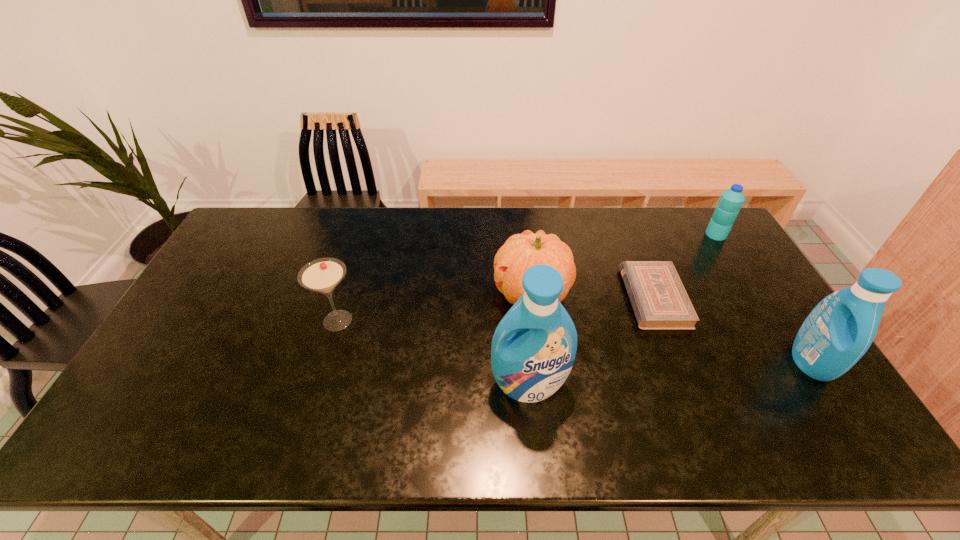
At what (x,y) coordinates should I click in order to perform the action: click on empty space between the fourth object from left to right and the farthest object. Please return your answer as a coordinate pair (x, y). This screenshot has width=960, height=540. Looking at the image, I should click on (685, 266).

Where is `unoccupied position between the water bottle and the taller detergent`? unoccupied position between the water bottle and the taller detergent is located at coordinates (623, 309).

This screenshot has height=540, width=960. Identify the location of vacant area between the Bible and the leftmost object. (495, 309).

Find the location of a particular element. The image size is (960, 540). empty location between the fourth shortest object and the third object from right to left is located at coordinates (592, 295).

Locate an element on the screen. The image size is (960, 540). free space between the farthest object and the shorter detergent is located at coordinates (763, 298).

Find the location of a particular element. This screenshot has width=960, height=540. object that is the second closest one to the Bible is located at coordinates (840, 329).

The width and height of the screenshot is (960, 540). I want to click on object that is the closest to the water bottle, so click(x=659, y=300).